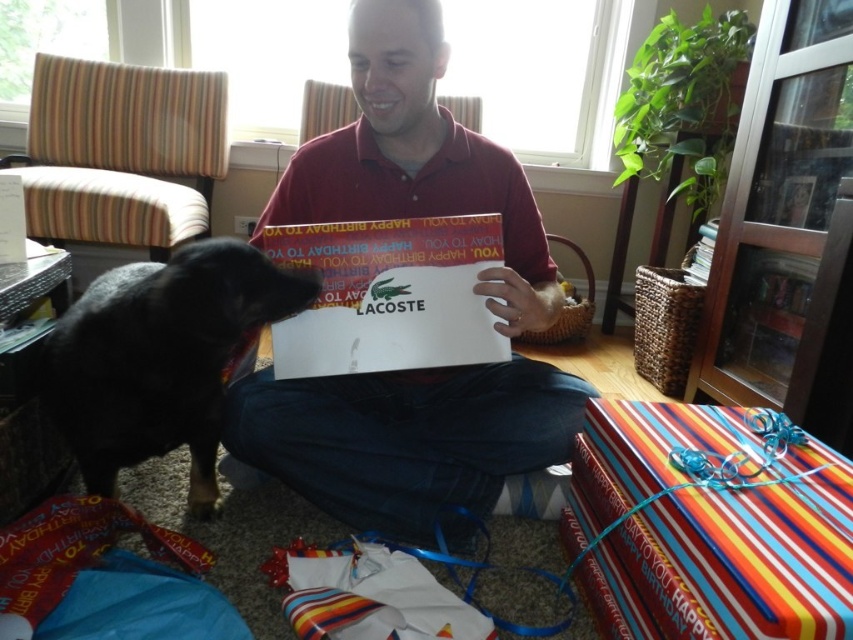
You are organizing a small gift presentation and need to place the matte red shirt at center and the striped paper gift at lower right on a shelf. If the shelf has limited space, which object should you place first to ensure both fit?

The striped paper gift at lower right should be placed first since it is narrower than the matte red shirt at center, allowing more space for the wider shirt afterward.